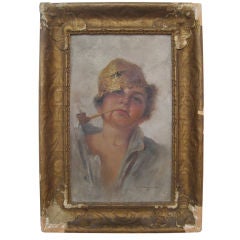
The image size is (240, 240). I want to click on picture frame, so click(x=89, y=13).